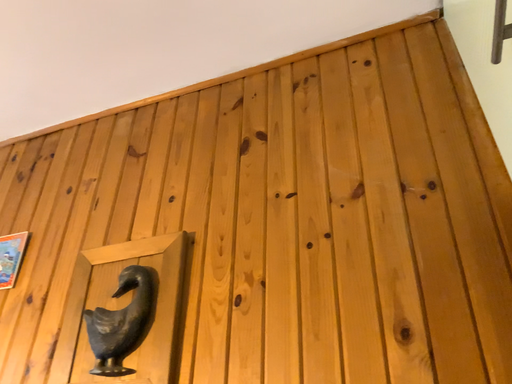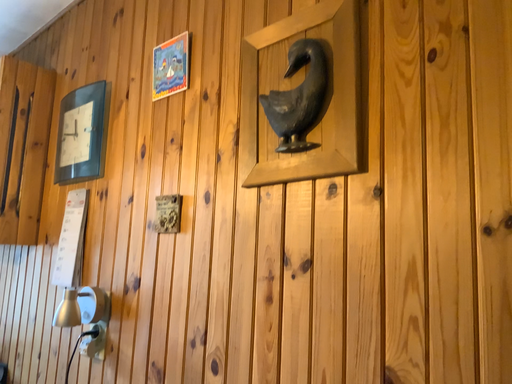
Question: Which way did the camera rotate in the video?

Choices:
 (A) rotated left
 (B) rotated right

Answer: (A)